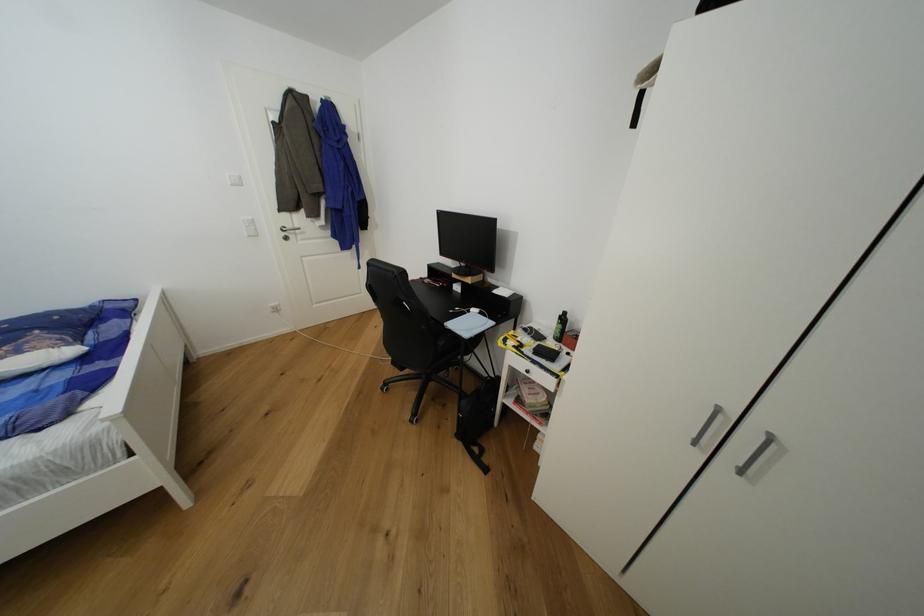
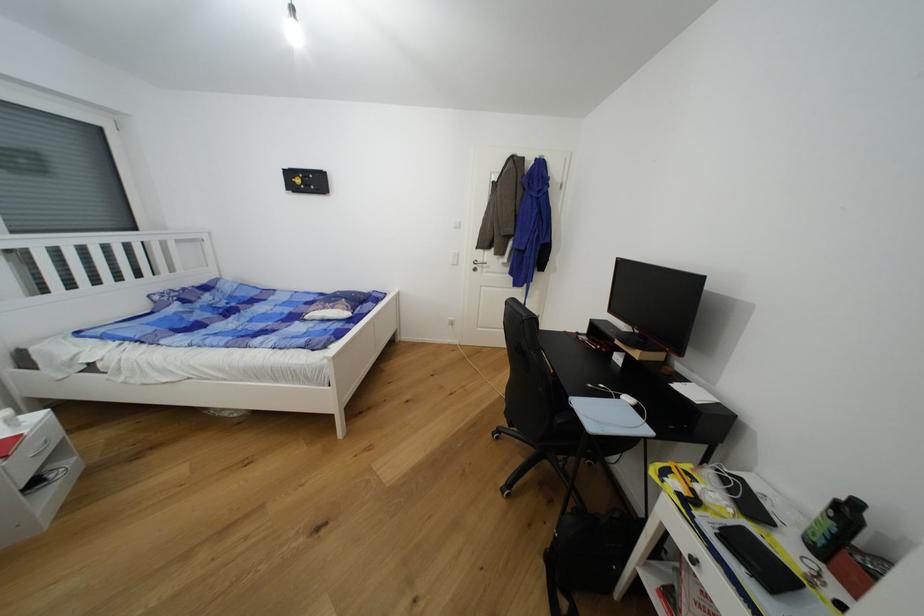
In the second image, find the point that corresponds to (x=544, y=347) in the first image.

(748, 531)